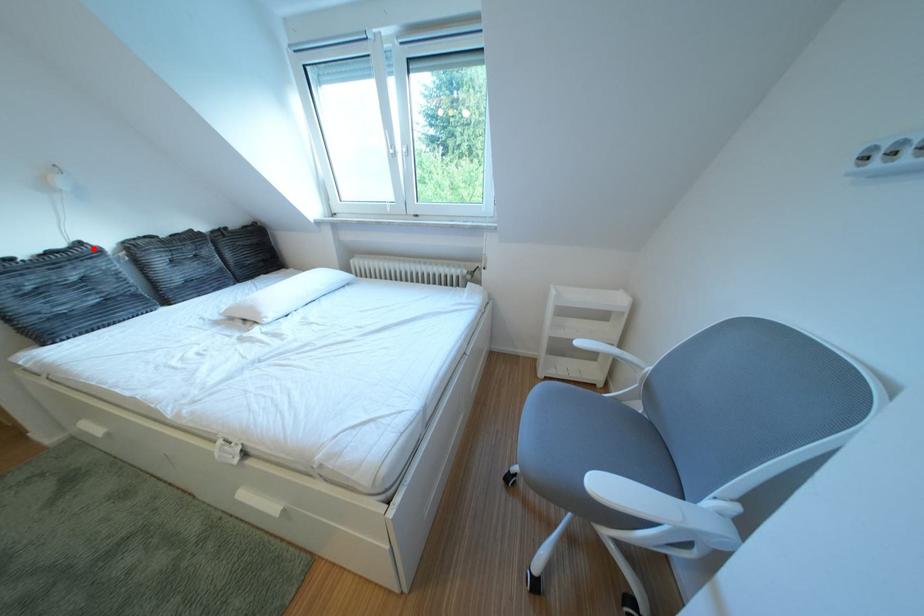
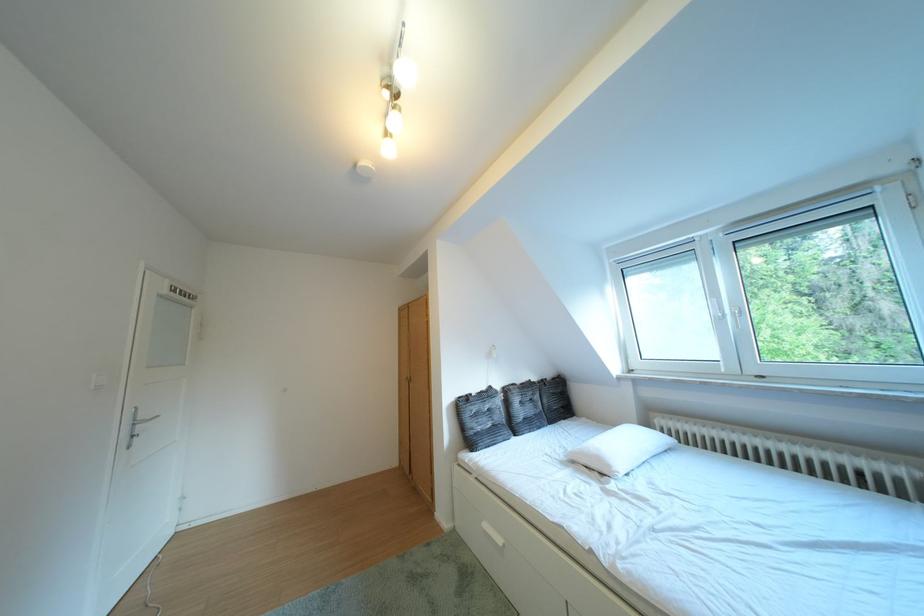
Locate, in the second image, the point that corresponds to the highlighted location in the first image.

(504, 392)